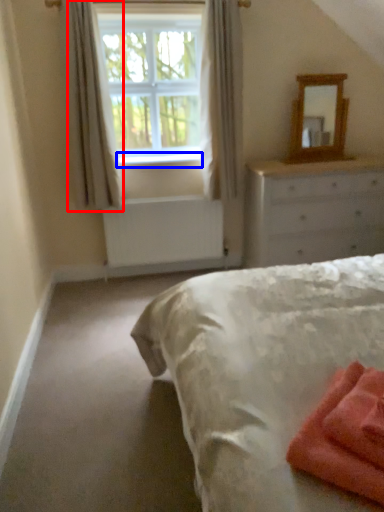
Question: Which of the following is the farthest to the observer, curtain (highlighted by a red box) or window sill (highlighted by a blue box)?

Choices:
 (A) curtain
 (B) window sill

Answer: (B)